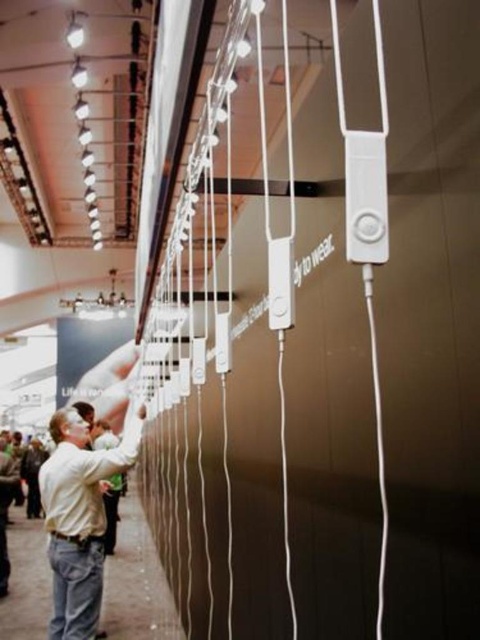
Question: Which object appears farthest from the camera in this image?

Choices:
 (A) light beige shirt at lower left
 (B) white matte shirt at center

Answer: (A)

Question: Which point is farther to the camera?

Choices:
 (A) (99, 540)
 (B) (0, 580)

Answer: (B)

Question: Is white matte shirt at center further to camera compared to light beige shirt at lower left?

Choices:
 (A) no
 (B) yes

Answer: (A)

Question: Is white matte shirt at center to the right of light beige shirt at lower left from the viewer's perspective?

Choices:
 (A) yes
 (B) no

Answer: (A)

Question: Can you confirm if white matte shirt at center is positioned to the left of light beige shirt at lower left?

Choices:
 (A) no
 (B) yes

Answer: (A)